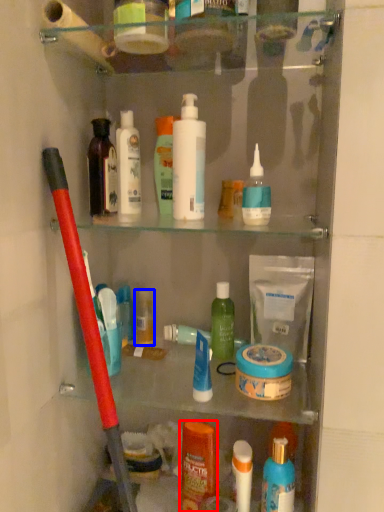
Question: Which of the following is the closest to the observer, toiletry (highlighted by a red box) or toiletry (highlighted by a blue box)?

Choices:
 (A) toiletry
 (B) toiletry

Answer: (A)